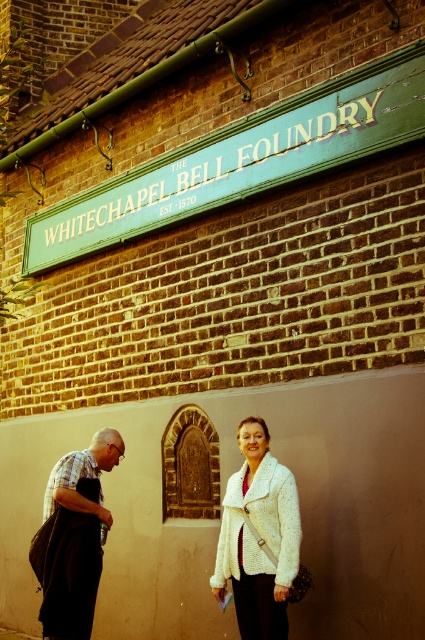
Question: Which point is closer to the camera taking this photo?

Choices:
 (A) (220, 564)
 (B) (283, 561)

Answer: (B)

Question: Does white textured sweater at center appear on the left side of white fluffy coat at lower center?

Choices:
 (A) no
 (B) yes

Answer: (B)

Question: Based on their relative distances, which object is farther from the white fluffy coat at lower center?

Choices:
 (A) green painted wood sign at upper center
 (B) plaid shirt at left

Answer: (A)

Question: Is white textured sweater at center to the left of white fluffy coat at lower center from the viewer's perspective?

Choices:
 (A) yes
 (B) no

Answer: (A)

Question: Which of the following is the farthest from the observer?

Choices:
 (A) white textured sweater at center
 (B) green painted wood sign at upper center

Answer: (A)

Question: Is white textured sweater at center thinner than plaid shirt at left?

Choices:
 (A) yes
 (B) no

Answer: (A)